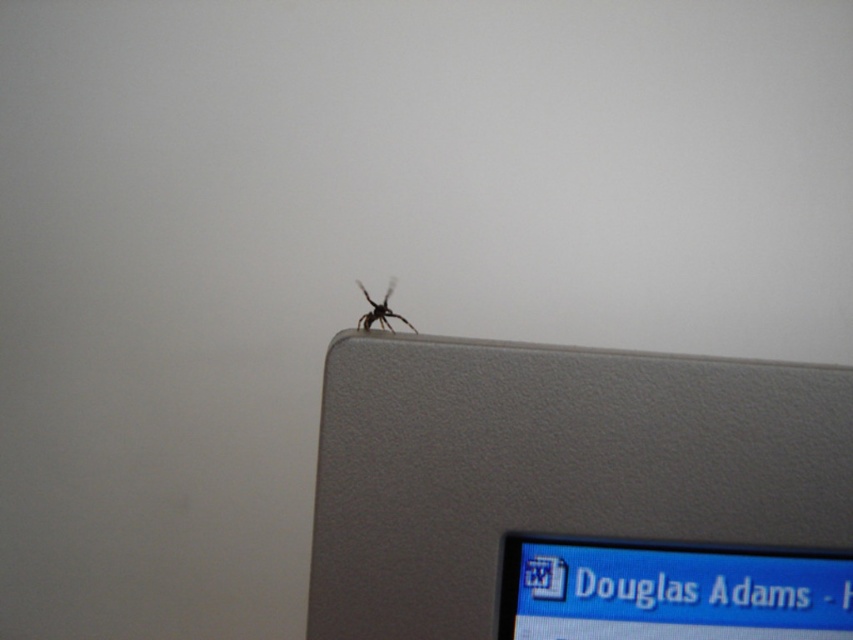
Question: Does satin silver laptop at upper right have a smaller size compared to matte gray computer monitor at upper right?

Choices:
 (A) yes
 (B) no

Answer: (B)

Question: In this image, where is satin silver laptop at upper right located relative to matte gray computer monitor at upper right?

Choices:
 (A) below
 (B) above

Answer: (B)

Question: Which of the following is the farthest from the observer?

Choices:
 (A) [369, 323]
 (B) [515, 600]
 (C) [590, 509]

Answer: (B)

Question: Which object is farther from the camera taking this photo?

Choices:
 (A) matte gray computer monitor at upper right
 (B) satin silver laptop at upper right

Answer: (A)

Question: Is satin silver laptop at upper right bigger than black fuzzy spider at upper center?

Choices:
 (A) no
 (B) yes

Answer: (B)

Question: Which point is closer to the camera?

Choices:
 (A) satin silver laptop at upper right
 (B) black fuzzy spider at upper center

Answer: (A)